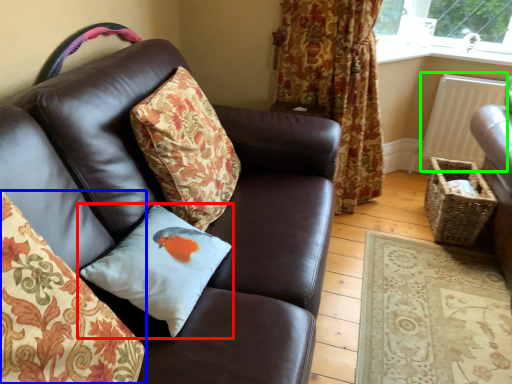
Question: Which is farther away from pillow (highlighted by a red box)? pillow (highlighted by a blue box) or radiator (highlighted by a green box)?

Choices:
 (A) pillow
 (B) radiator

Answer: (B)